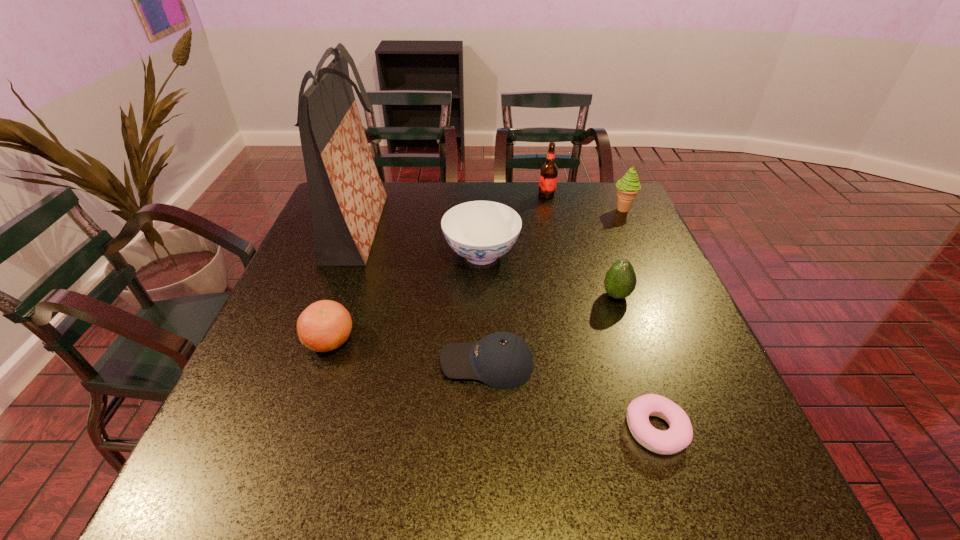
This screenshot has width=960, height=540. In order to click on vacant area that satisfies the following two spatial constraints: 1. on the front-facing side of the shortest object; 2. on the right side of the baseball cap in this screenshot , I will do `click(488, 430)`.

You are a GUI agent. You are given a task and a screenshot of the screen. Output one action in this format:
    pyautogui.click(x=<x>, y=<y>)
    Task: Click on the vacant space that satisfies the following two spatial constraints: 1. on the back side of the fourth nearest object; 2. on the front-facing side of the shopping bag
    
    Given the screenshot: What is the action you would take?
    pyautogui.click(x=593, y=228)